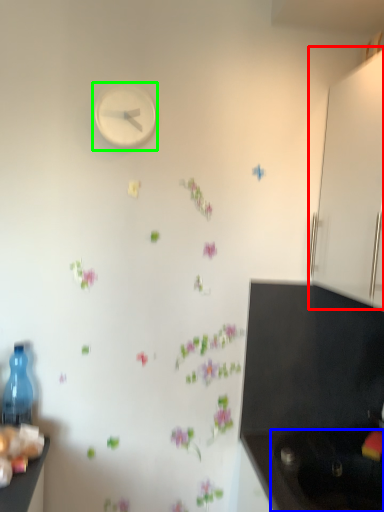
Question: Which object is positioned closest to cabinetry (highlighted by a red box)? Select from sink (highlighted by a blue box) and clock (highlighted by a green box).

Choices:
 (A) sink
 (B) clock

Answer: (B)